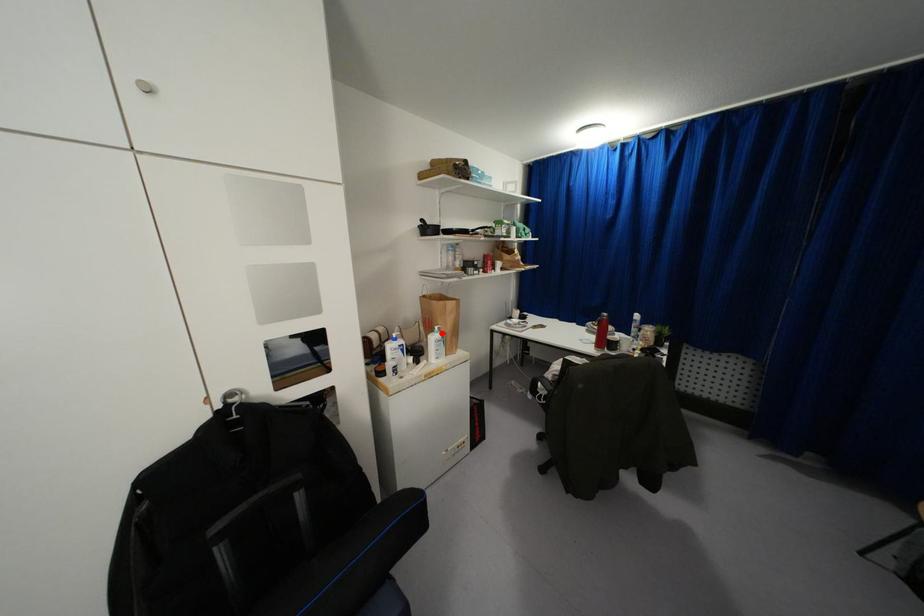
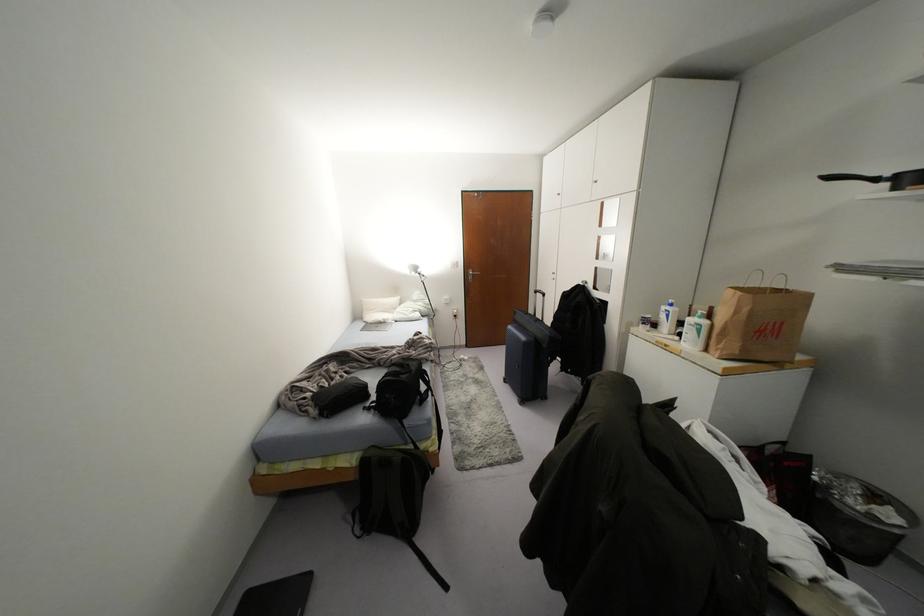
Find the pixel in the second image that matches the highlighted location in the first image.

(703, 322)